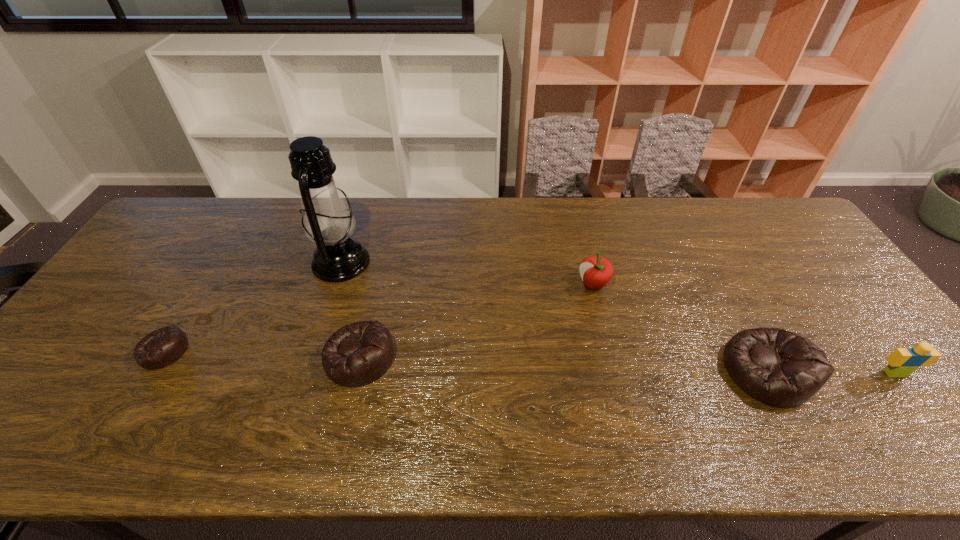
Find the location of `free location located on the back of the rightmost beanbag`. free location located on the back of the rightmost beanbag is located at coordinates (707, 260).

What are the coordinates of `vacant space located 0.110m on the right of the oil lamp` in the screenshot? It's located at (405, 262).

At what (x,y) coordinates should I click in order to perform the action: click on free space located 0.130m on the left of the apple. Please return your answer as a coordinate pair (x, y). Looking at the image, I should click on (533, 285).

This screenshot has height=540, width=960. I want to click on object located at the far edge, so click(x=328, y=221).

Locate an element on the screen. object present at the right edge is located at coordinates (902, 362).

You are a GUI agent. You are given a task and a screenshot of the screen. Output one action in this format:
    pyautogui.click(x=<x>, y=<y>)
    Task: Click on the blank area at the far edge
    This screenshot has height=540, width=960.
    Given the screenshot: What is the action you would take?
    pyautogui.click(x=448, y=210)

Where is `free location at the near edge of the desktop`? This screenshot has height=540, width=960. free location at the near edge of the desktop is located at coordinates (264, 413).

In the image, there is a desktop. Where is `vacant space at the left edge`? vacant space at the left edge is located at coordinates (171, 245).

Locate an element on the screen. blank space at the near left corner of the desktop is located at coordinates (65, 409).

What are the coordinates of `free location at the far right corner` in the screenshot? It's located at 776,229.